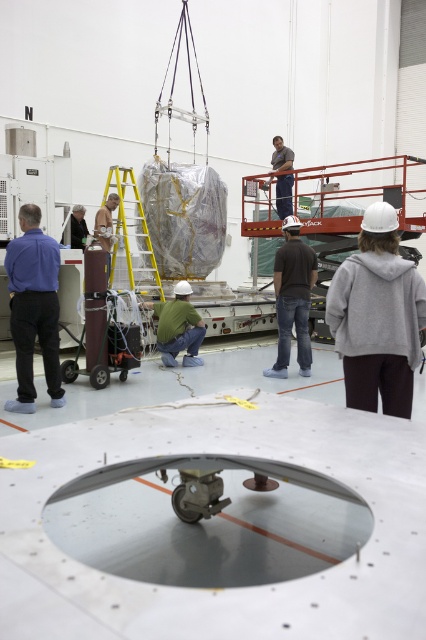
Question: Among these objects, which one is farthest from the camera?

Choices:
 (A) dark gray shirt at center
 (B) matte blue shirt at left

Answer: (A)

Question: Considering the real-world distances, which object is farthest from the matte blue shirt at left?

Choices:
 (A) yellow/yellowish metal ladder at center
 (B) dark gray shirt at center

Answer: (A)

Question: Is the position of dark gray shirt at center more distant than that of yellow/yellowish metal ladder at center?

Choices:
 (A) yes
 (B) no

Answer: (B)

Question: Does matte blue shirt at left have a greater width compared to yellow/yellowish metal ladder at center?

Choices:
 (A) no
 (B) yes

Answer: (A)

Question: Does matte blue shirt at left have a larger size compared to yellow/yellowish metal ladder at center?

Choices:
 (A) yes
 (B) no

Answer: (B)

Question: Which point is farther to the camera?

Choices:
 (A) (25, 317)
 (B) (264, 371)

Answer: (B)